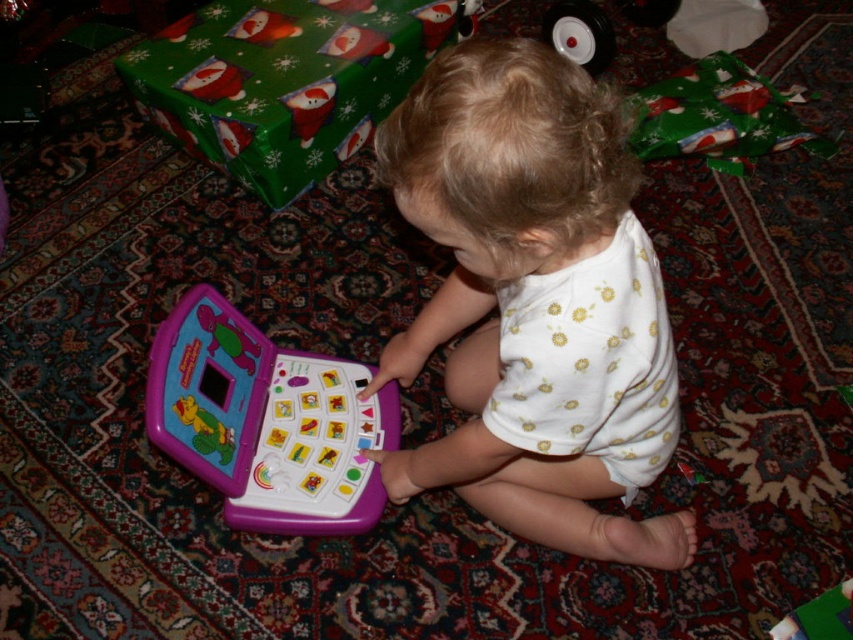
Question: Does white dotted fabric at center lie in front of purple plastic toy at center?

Choices:
 (A) yes
 (B) no

Answer: (A)

Question: Can you confirm if white dotted fabric at center is positioned to the left of purple plastic toy at center?

Choices:
 (A) yes
 (B) no

Answer: (B)

Question: Which object is farther from the camera taking this photo?

Choices:
 (A) white dotted fabric at center
 (B) purple plastic toy at center

Answer: (B)

Question: Which point is closer to the camera?

Choices:
 (A) white dotted fabric at center
 (B) purple plastic toy at center

Answer: (A)

Question: Is white dotted fabric at center above purple plastic toy at center?

Choices:
 (A) no
 (B) yes

Answer: (B)